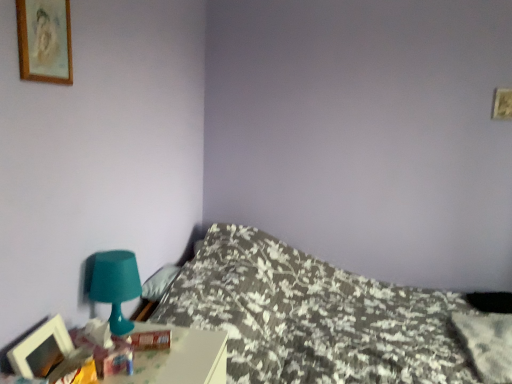
Question: Can you confirm if wooden-framed painting at upper left, the 2th picture frame in the bottom-to-top sequence, is smaller than fluffy white pillow at upper left, which is counted as the second pillow, starting from the bottom?

Choices:
 (A) no
 (B) yes

Answer: (B)

Question: Does wooden-framed painting at upper left, the 2th picture frame in the bottom-to-top sequence, have a lesser height compared to fluffy white pillow at upper left, which is counted as the second pillow, starting from the bottom?

Choices:
 (A) yes
 (B) no

Answer: (B)

Question: Are wooden-framed painting at upper left, the 2th picture frame in the bottom-to-top sequence, and fluffy white pillow at upper left, positioned as the 1th pillow in top-to-bottom order, making contact?

Choices:
 (A) yes
 (B) no

Answer: (B)

Question: Is wooden-framed painting at upper left, the first picture frame viewed from the top, turned away from fluffy white pillow at upper left, marked as the first pillow in a left-to-right arrangement?

Choices:
 (A) yes
 (B) no

Answer: (B)

Question: Is wooden-framed painting at upper left, the 2th picture frame in the bottom-to-top sequence, positioned before fluffy white pillow at upper left, marked as the first pillow in a left-to-right arrangement?

Choices:
 (A) no
 (B) yes

Answer: (B)

Question: Is fluffy white pillow at upper left, marked as the first pillow in a left-to-right arrangement, inside the boundaries of wooden picture frame at lower left, arranged as the 1th picture frame when ordered from the bottom, or outside?

Choices:
 (A) outside
 (B) inside

Answer: (A)

Question: From the image's perspective, is fluffy white pillow at upper left, which is counted as the second pillow, starting from the bottom, positioned above or below wooden picture frame at lower left, arranged as the 1th picture frame when ordered from the bottom?

Choices:
 (A) above
 (B) below

Answer: (A)

Question: Does point (155, 276) appear closer or farther from the camera than point (39, 347)?

Choices:
 (A) closer
 (B) farther

Answer: (B)

Question: From a real-world perspective, is fluffy white pillow at upper left, which is counted as the second pillow, starting from the bottom, positioned above or below wooden picture frame at lower left, arranged as the 1th picture frame when ordered from the bottom?

Choices:
 (A) below
 (B) above

Answer: (A)

Question: Considering the positions of floral-patterned fabric bed at lower left and fluffy white pillow at center, the 1th pillow positioned from the bottom, in the image, is floral-patterned fabric bed at lower left wider or thinner than fluffy white pillow at center, the 1th pillow positioned from the bottom,?

Choices:
 (A) wide
 (B) thin

Answer: (A)

Question: From the image's perspective, is floral-patterned fabric bed at lower left located above or below fluffy white pillow at center, the 1th pillow positioned from the bottom?

Choices:
 (A) above
 (B) below

Answer: (B)

Question: From their relative heights in the image, would you say floral-patterned fabric bed at lower left is taller or shorter than fluffy white pillow at center, the 1th pillow positioned from the bottom?

Choices:
 (A) short
 (B) tall

Answer: (B)

Question: Is floral-patterned fabric bed at lower left to the left or to the right of fluffy white pillow at center, the second pillow viewed from the left, in the image?

Choices:
 (A) right
 (B) left

Answer: (B)

Question: Looking at their shapes, would you say fluffy white pillow at upper left, marked as the first pillow in a left-to-right arrangement, is wider or thinner than teal plastic table lamp at lower left?

Choices:
 (A) thin
 (B) wide

Answer: (A)

Question: Based on their positions, is fluffy white pillow at upper left, the second pillow in the right-to-left sequence, located to the left or right of teal plastic table lamp at lower left?

Choices:
 (A) right
 (B) left

Answer: (A)